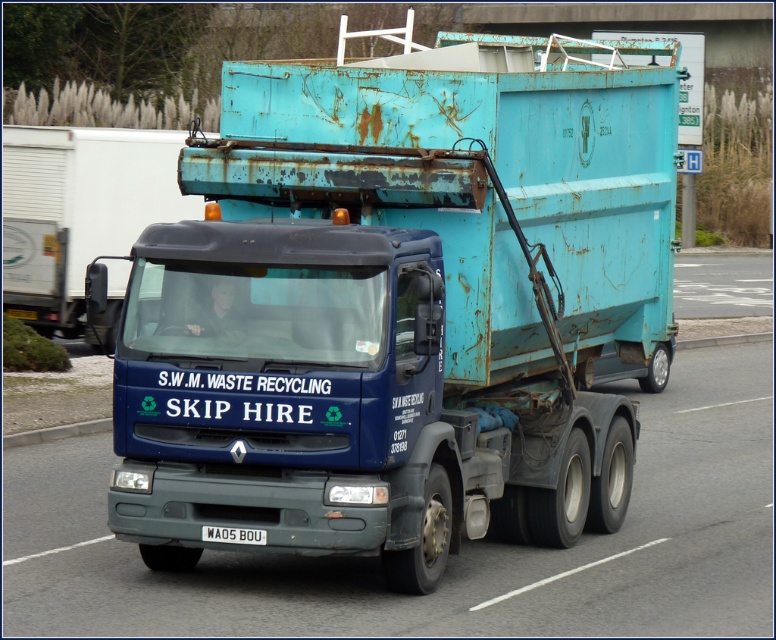
In the scene shown: You are a traffic officer observing a vehicle with a rusty metal skip at center and a white plastic license plate at center. Which object is bigger?

The rusty metal skip at center is larger in size than the white plastic license plate at center.

Based on the photo, you are a traffic officer observing a large truck with two skips attached at the center. The truck is driving on a road with white lane markings. You need to ensure the skips comply with height restrictions of 3 meters. Which skip, the rusty metal skip at center or the blue metallic skip at center, might exceed the height limit?

The rusty metal skip at center is much taller than the blue metallic skip at center, so the rusty metal skip at center might exceed the 3 meters height limit.